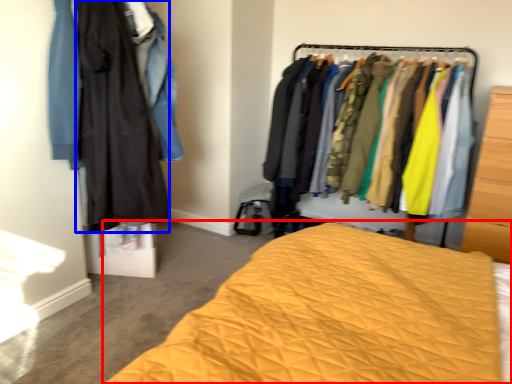
Question: Which object appears closest to the camera in this image, bed (highlighted by a red box) or clothing (highlighted by a blue box)?

Choices:
 (A) bed
 (B) clothing

Answer: (A)